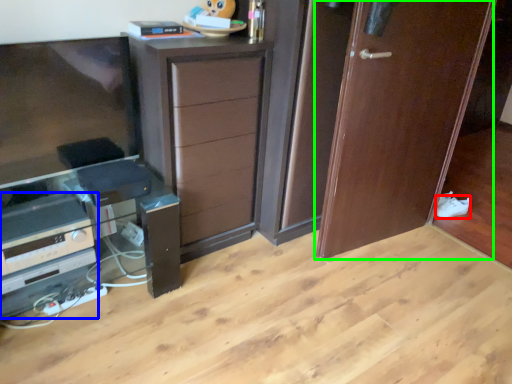
Question: Estimate the real-world distances between objects in this image. Which object is farther from shoe (highlighted by a red box), appliance (highlighted by a blue box) or door (highlighted by a green box)?

Choices:
 (A) appliance
 (B) door

Answer: (A)